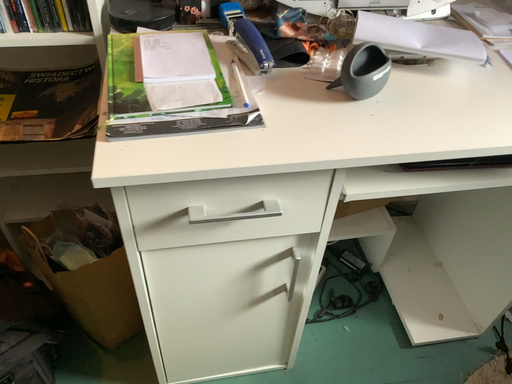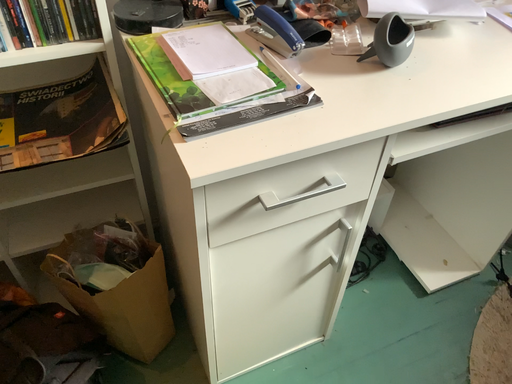
Question: Which way did the camera rotate in the video?

Choices:
 (A) rotated right
 (B) rotated left

Answer: (A)